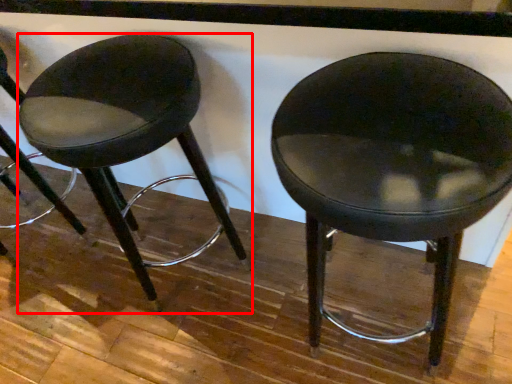
Question: From the image's perspective, where is stool (annotated by the red box) located relative to chair?

Choices:
 (A) above
 (B) below

Answer: (A)